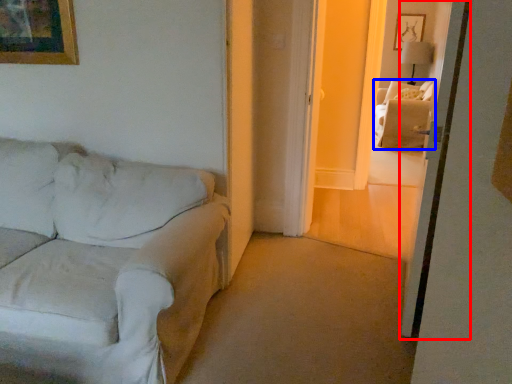
Question: Which point is further to the camera, screen door (highlighted by a red box) or couch (highlighted by a blue box)?

Choices:
 (A) screen door
 (B) couch

Answer: (B)